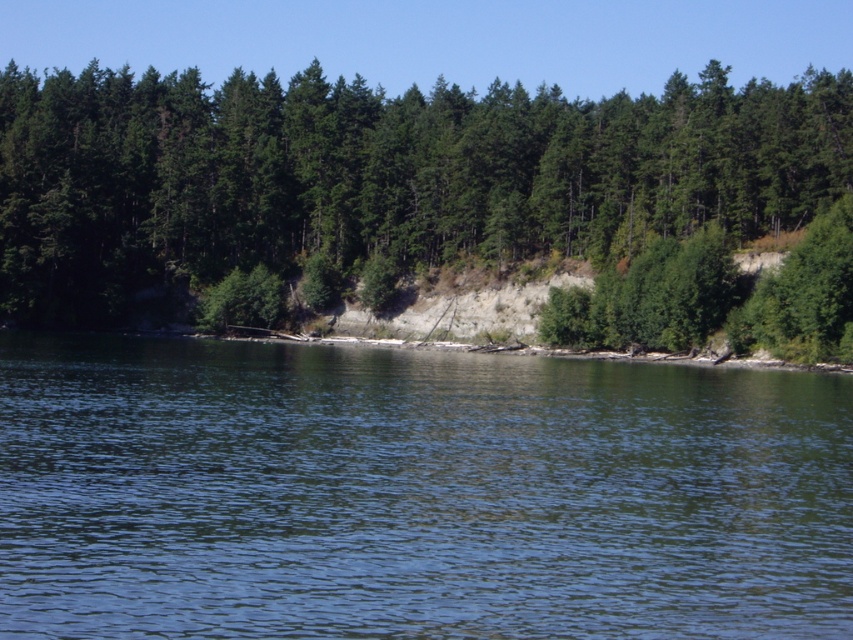
Looking at this image, you are standing on the shore and want to take a photo of both the clear water at center and the green matte trees at upper center. Which object will appear larger in the photo?

The green matte trees at upper center will appear larger in the photo because they are closer to the observer than the clear water at center, which is smaller in size.

You are standing on the shore looking at the clear water at center and the green matte trees at upper center. Which object is closer to you?

The clear water at center is closer to the viewer than the green matte trees at upper center.